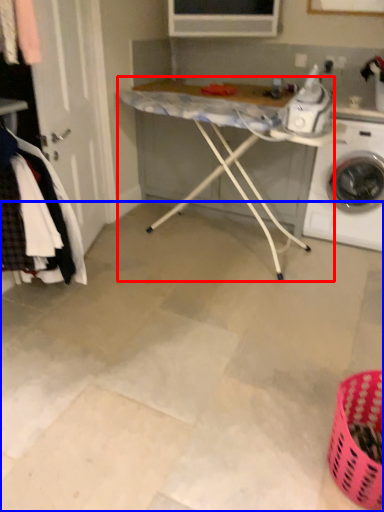
Question: Which object is further to the camera taking this photo, table (highlighted by a red box) or concrete (highlighted by a blue box)?

Choices:
 (A) table
 (B) concrete

Answer: (A)